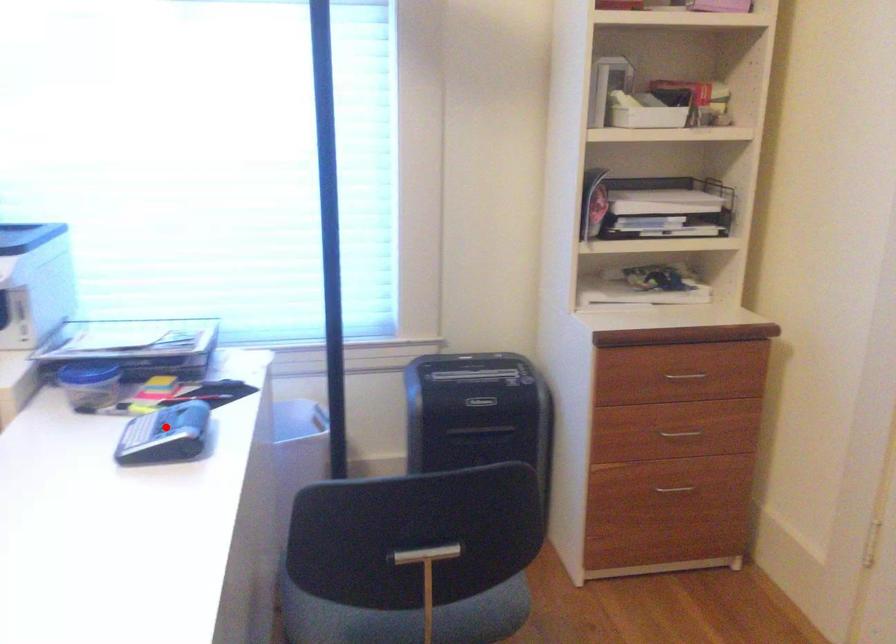
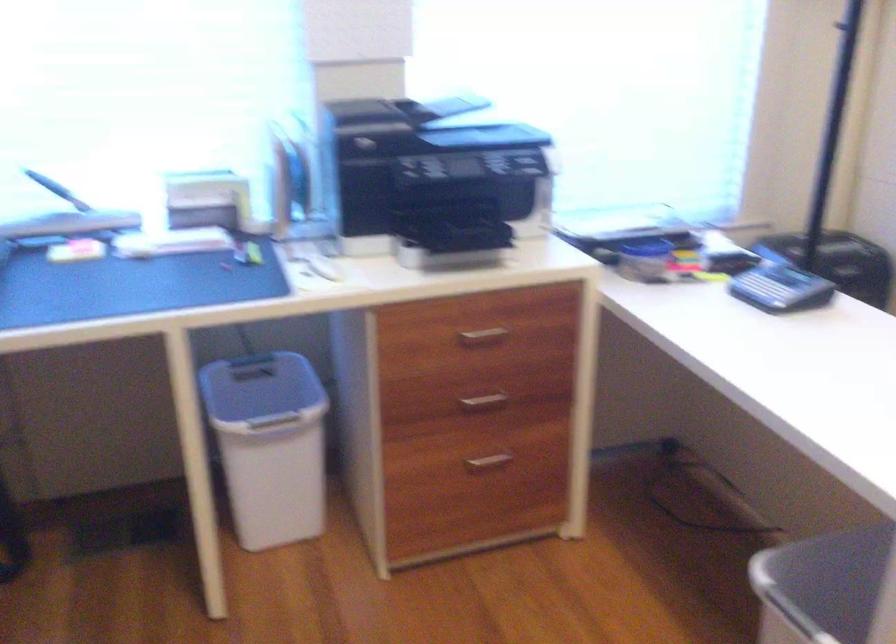
Where in the second image is the point corresponding to the highlighted location from the first image?

(780, 288)